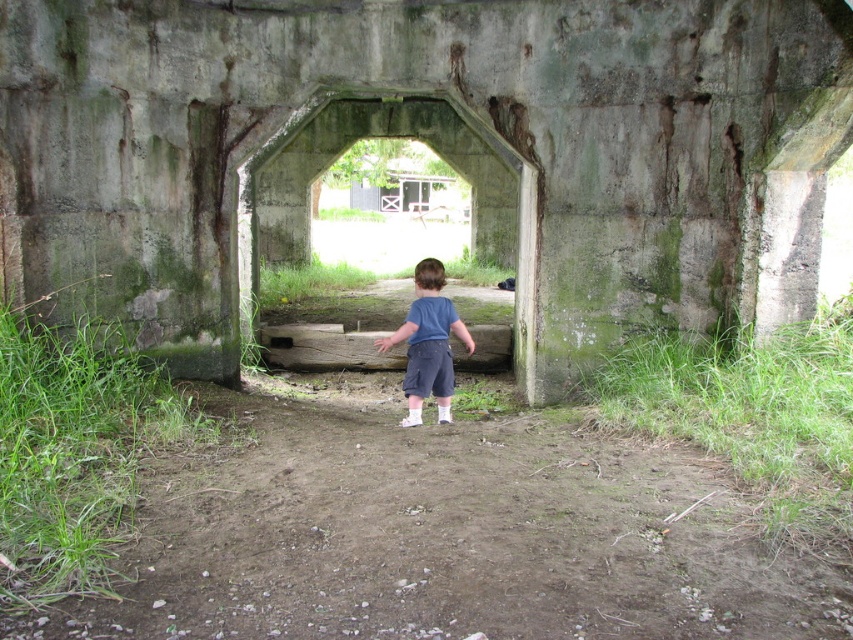
You are a maintenance worker who needs to inspect the green concrete tunnel at center. You are currently standing where the blue cotton shirt at center is located. Can you walk directly to the tunnel without needing to move any obstacles?

The green concrete tunnel at center is 3.64 meters away from the blue cotton shirt at center. Since there are no obstacles mentioned in the scene description between them, you can walk directly to the tunnel.

You are a construction worker assessing the stability of the dirt ground at center and the green concrete tunnel at center. Which object has a narrower width?

The dirt ground at center is thinner than the green concrete tunnel at center, so the dirt ground at center has a narrower width.

You are a parent looking for your child. You see the dirt ground at center and the blue cotton shirt at center in the scene. How far apart are these two objects?

The dirt ground at center and blue cotton shirt at center are 5.60 feet apart.